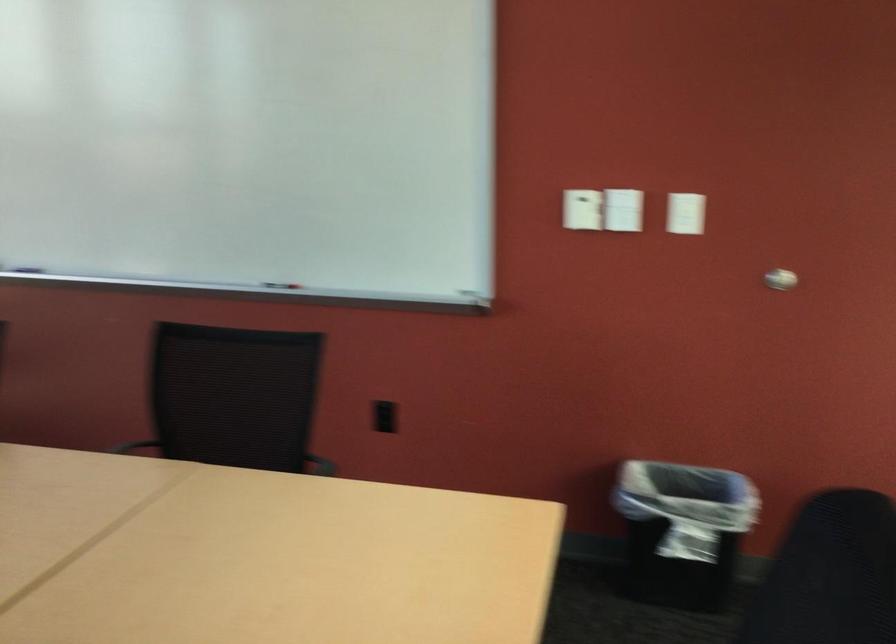
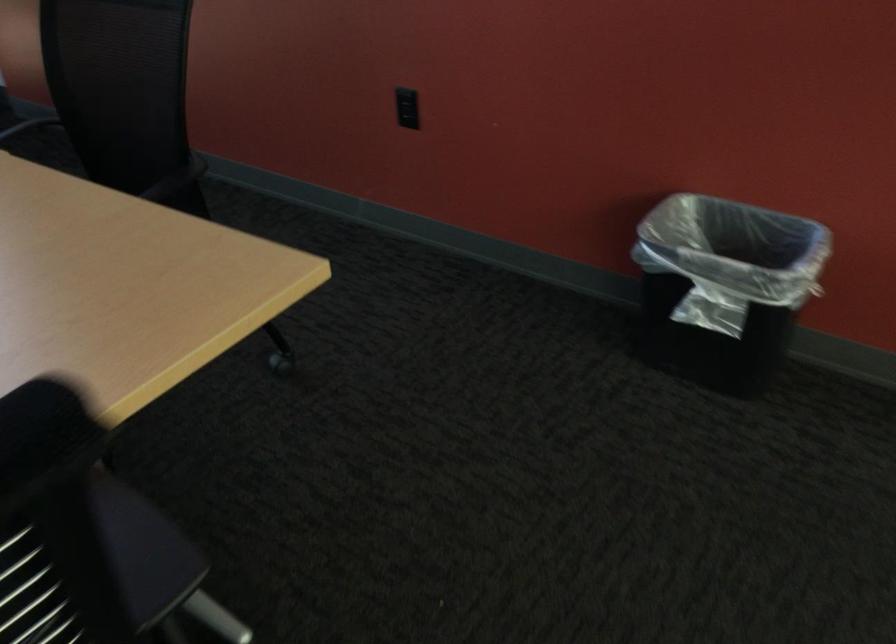
Which direction would the cameraman need to move to produce the second image?

The cameraman moved toward right, forward.